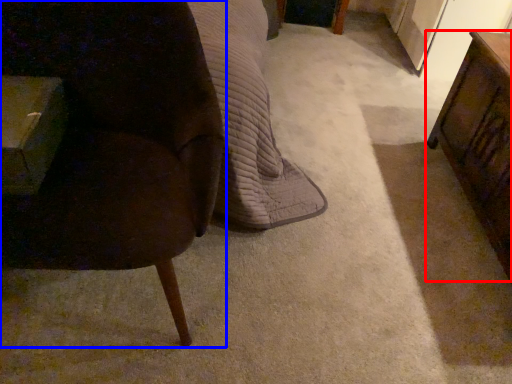
Question: Which object appears closest to the camera in this image, table (highlighted by a red box) or chair (highlighted by a blue box)?

Choices:
 (A) table
 (B) chair

Answer: (B)